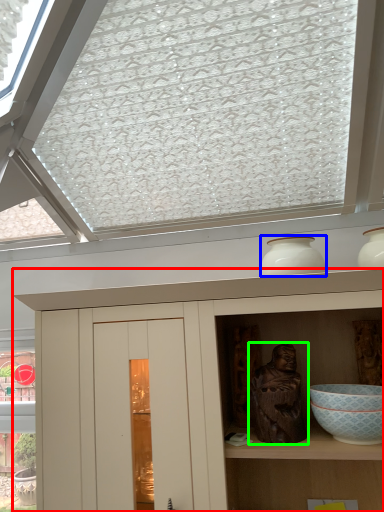
Question: Which object is positioned farthest from cupboard (highlighted by a red box)? Select from vase (highlighted by a blue box) and sculpture (highlighted by a green box).

Choices:
 (A) vase
 (B) sculpture

Answer: (A)